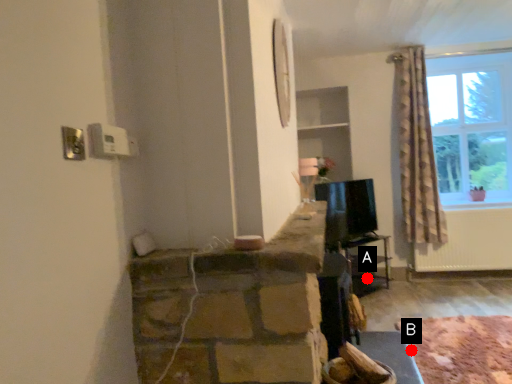
Question: Two points are circled on the image, labeled by A and B beside each circle. Which of the following is the closest to the observer?

Choices:
 (A) A is closer
 (B) B is closer

Answer: (B)